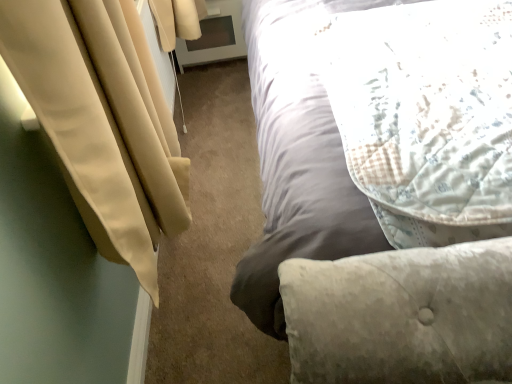
Question: From the image's perspective, is beige fabric curtain at left above or below light gray fabric bed at upper right?

Choices:
 (A) below
 (B) above

Answer: (A)

Question: Considering the positions of beige fabric curtain at left and light gray fabric bed at upper right in the image, is beige fabric curtain at left wider or thinner than light gray fabric bed at upper right?

Choices:
 (A) thin
 (B) wide

Answer: (A)

Question: Estimate the real-world distances between objects in this image. Which object is farther from the beige fabric curtain at left?

Choices:
 (A) light gray fabric bed at upper right
 (B) fluffy white pillow at upper right

Answer: (B)

Question: Considering the real-world distances, which object is farthest from the light gray fabric bed at upper right?

Choices:
 (A) beige fabric curtain at left
 (B) fluffy white pillow at upper right

Answer: (A)